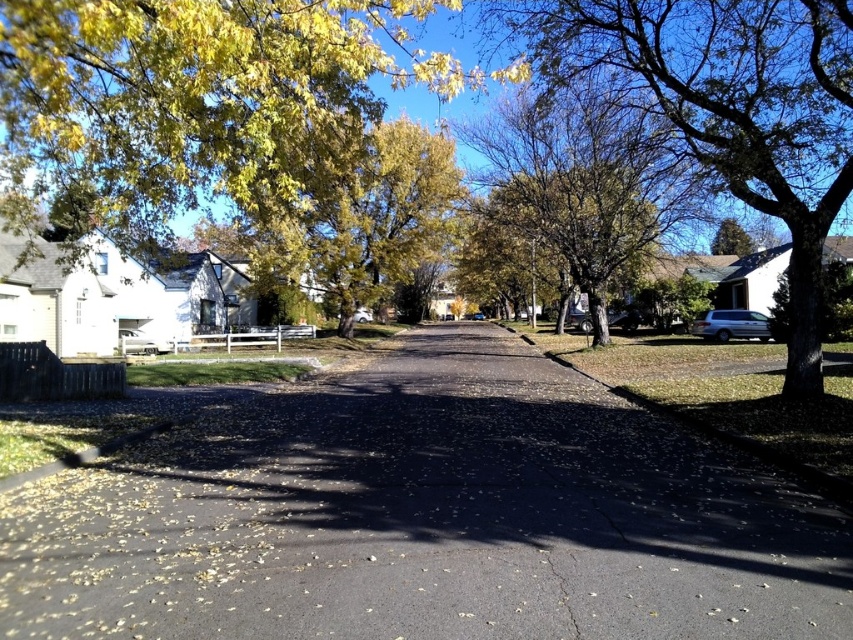
Question: Which object appears farthest from the camera in this image?

Choices:
 (A) green leafy tree at right
 (B) asphalt at center

Answer: (A)

Question: Which object appears farthest from the camera in this image?

Choices:
 (A) green leafy tree at right
 (B) asphalt at center

Answer: (A)

Question: Can you confirm if asphalt at center is bigger than green leafy tree at right?

Choices:
 (A) no
 (B) yes

Answer: (A)

Question: Observing the image, what is the correct spatial positioning of asphalt at center in reference to green leafy tree at right?

Choices:
 (A) right
 (B) left

Answer: (B)

Question: Does asphalt at center appear over green leafy tree at right?

Choices:
 (A) yes
 (B) no

Answer: (B)